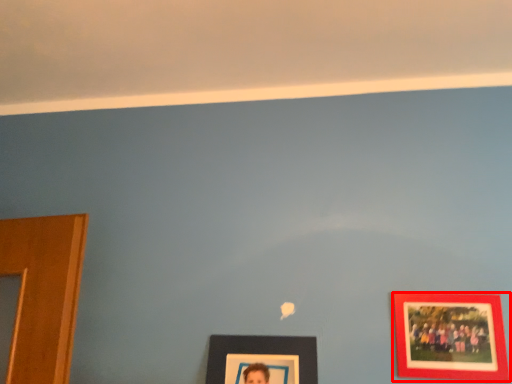
Question: In this image, where is picture frame (annotated by the red box) located relative to picture frame?

Choices:
 (A) right
 (B) left

Answer: (A)